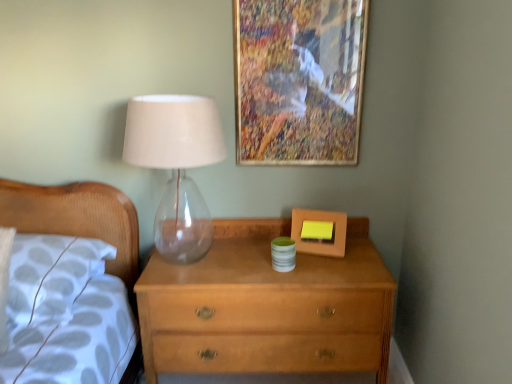
Question: Can we say white fabric pillow at left lies outside transparent glass table lamp at left?

Choices:
 (A) yes
 (B) no

Answer: (A)

Question: Would you say white fabric pillow at left is a long distance from transparent glass table lamp at left?

Choices:
 (A) no
 (B) yes

Answer: (A)

Question: Does white fabric pillow at left appear on the left side of transparent glass table lamp at left?

Choices:
 (A) yes
 (B) no

Answer: (A)

Question: Considering the relative sizes of white fabric pillow at left and transparent glass table lamp at left in the image provided, is white fabric pillow at left thinner than transparent glass table lamp at left?

Choices:
 (A) no
 (B) yes

Answer: (A)

Question: Does white fabric pillow at left appear on the right side of transparent glass table lamp at left?

Choices:
 (A) no
 (B) yes

Answer: (A)

Question: Considering the positions of point [x=26, y=281] and point [x=181, y=170], is point [x=26, y=281] closer or farther from the camera than point [x=181, y=170]?

Choices:
 (A) farther
 (B) closer

Answer: (B)

Question: Is white fabric pillow at left to the left or to the right of transparent glass table lamp at left in the image?

Choices:
 (A) right
 (B) left

Answer: (B)

Question: Choose the correct answer: Is white fabric pillow at left inside transparent glass table lamp at left or outside it?

Choices:
 (A) inside
 (B) outside

Answer: (B)

Question: In terms of height, does white fabric pillow at left look taller or shorter compared to transparent glass table lamp at left?

Choices:
 (A) short
 (B) tall

Answer: (A)

Question: Considering the positions of wooden picture frame at upper center, the 1th picture frame viewed from the top, and matte wooden picture frame at center, which is counted as the first picture frame, starting from the bottom, in the image, is wooden picture frame at upper center, the 1th picture frame viewed from the top, wider or thinner than matte wooden picture frame at center, which is counted as the first picture frame, starting from the bottom,?

Choices:
 (A) thin
 (B) wide

Answer: (A)

Question: From the image's perspective, is wooden picture frame at upper center, which appears as the 2th picture frame when ordered from the bottom, located above or below matte wooden picture frame at center, the 2th picture frame in the top-to-bottom sequence?

Choices:
 (A) below
 (B) above

Answer: (B)

Question: Considering their positions, is wooden picture frame at upper center, which appears as the 2th picture frame when ordered from the bottom, located in front of or behind matte wooden picture frame at center, the 2th picture frame in the top-to-bottom sequence?

Choices:
 (A) behind
 (B) front

Answer: (B)

Question: Visually, is wooden picture frame at upper center, which appears as the 2th picture frame when ordered from the bottom, positioned to the left or to the right of matte wooden picture frame at center, which is counted as the first picture frame, starting from the bottom?

Choices:
 (A) left
 (B) right

Answer: (A)

Question: From a real-world perspective, is transparent glass table lamp at left above or below white fabric pillow at left?

Choices:
 (A) below
 (B) above

Answer: (B)

Question: Is transparent glass table lamp at left taller or shorter than white fabric pillow at left?

Choices:
 (A) short
 (B) tall

Answer: (B)